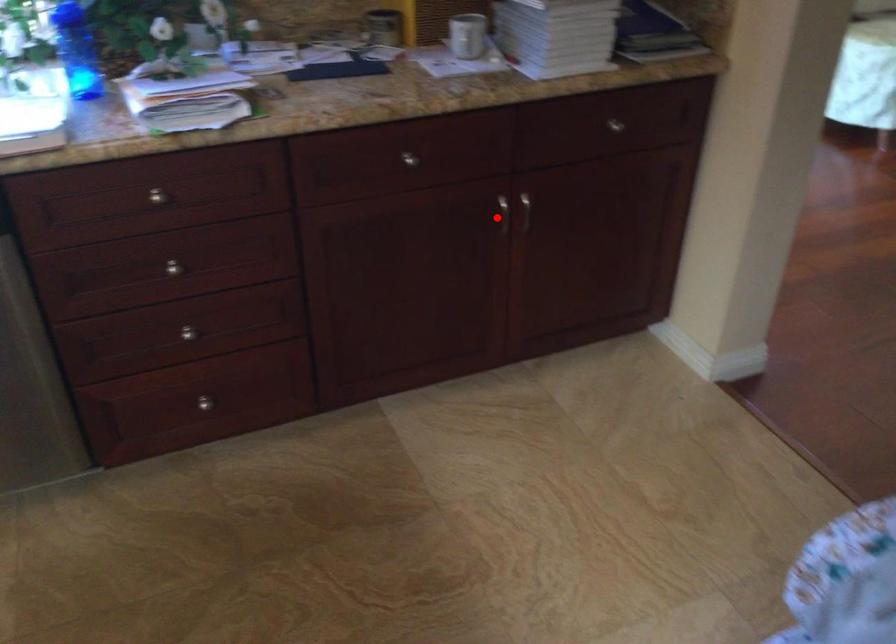
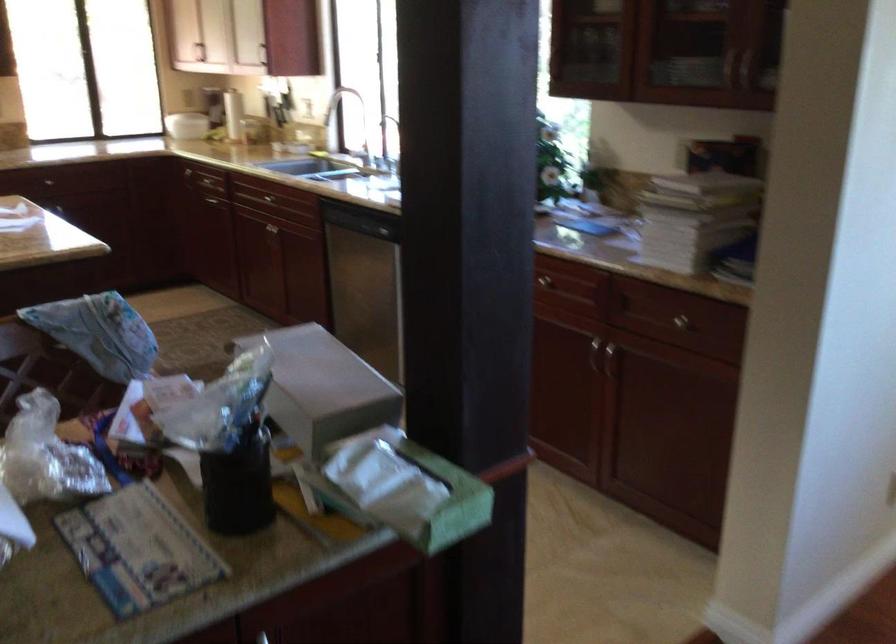
Question: A red point is marked in image1. In image2, is the corresponding 3D point closer to the camera or farther? Reply with the corresponding letter.

Choices:
 (A) The corresponding 3D point is closer.
 (B) The corresponding 3D point is farther.

Answer: (B)